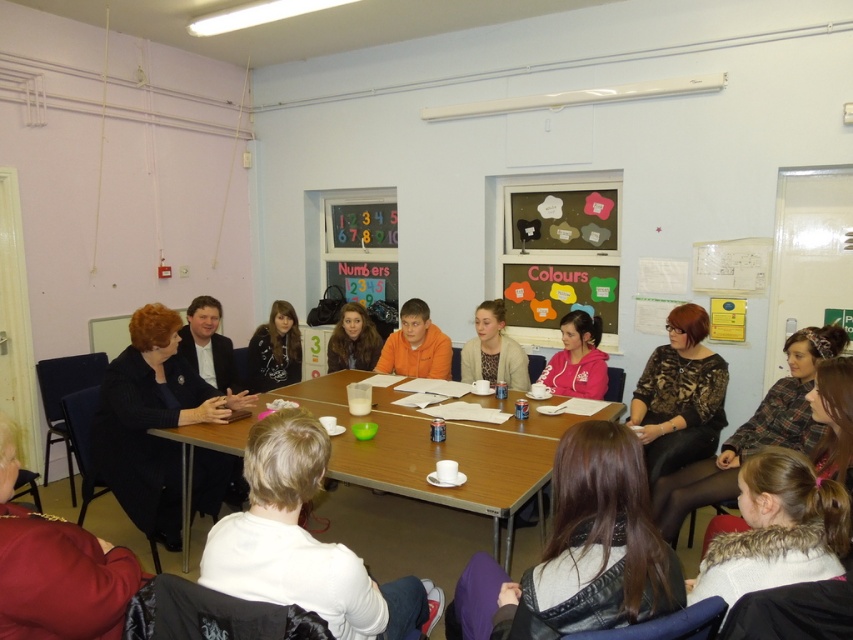
You are organizing a classroom event and need to place a small plant between the black textured blazer at left and the matte black jacket at center. According to the scene description, where should you position the plant?

The black textured blazer at left is located below the matte black jacket at center, so you should place the plant between them horizontally, ensuring it sits above the blazer and below the jacket to maintain proper alignment.

You are organizing a classroom wardrobe and need to decide which clothing item takes up more space. Based on the image, which item between the patterned fabric blouse at center and the matte black jacket at center requires more storage space?

The patterned fabric blouse at center is bigger than the matte black jacket at center, so it requires more storage space.